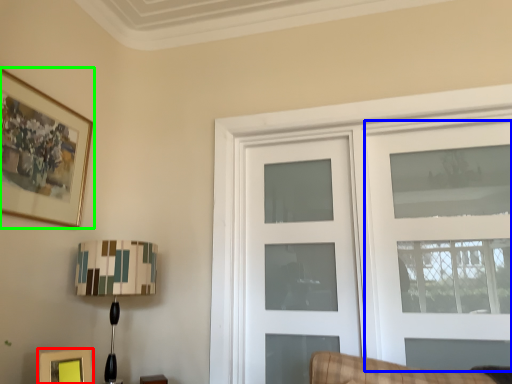
Question: Estimate the real-world distances between objects in this image. Which object is closer to picture frame (highlighted by a red box), door (highlighted by a blue box) or picture frame (highlighted by a green box)?

Choices:
 (A) door
 (B) picture frame

Answer: (B)